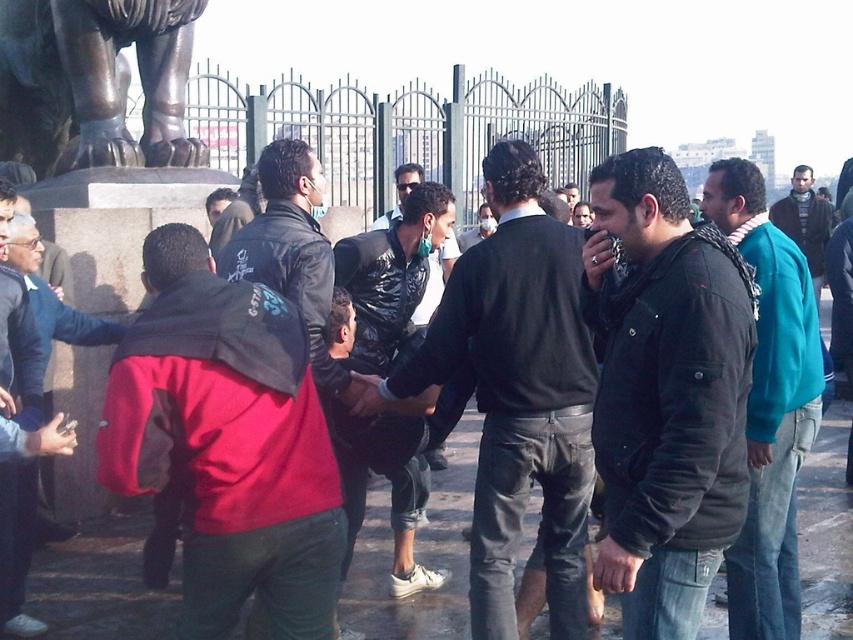
Question: Which of the following is the farthest from the observer?

Choices:
 (A) black matte jacket at center
 (B) teal sweater at right
 (C) shiny black jacket at center

Answer: (B)

Question: Estimate the real-world distances between objects in this image. Which object is farther from the teal sweater at right?

Choices:
 (A) shiny black jacket at center
 (B) black matte jacket at center

Answer: (A)

Question: From the image, what is the correct spatial relationship of teal fleece jacket at right in relation to teal sweater at right?

Choices:
 (A) right
 (B) left

Answer: (B)

Question: Is red matte jacket at center further to the viewer compared to teal sweater at right?

Choices:
 (A) yes
 (B) no

Answer: (B)

Question: Which object is positioned farthest from the red matte jacket at center?

Choices:
 (A) teal sweater at right
 (B) bronze statue at upper left
 (C) black matte jacket at center
 (D) teal fleece jacket at right

Answer: (A)

Question: In this image, where is teal fleece jacket at right located relative to shiny black jacket at center?

Choices:
 (A) right
 (B) left

Answer: (A)